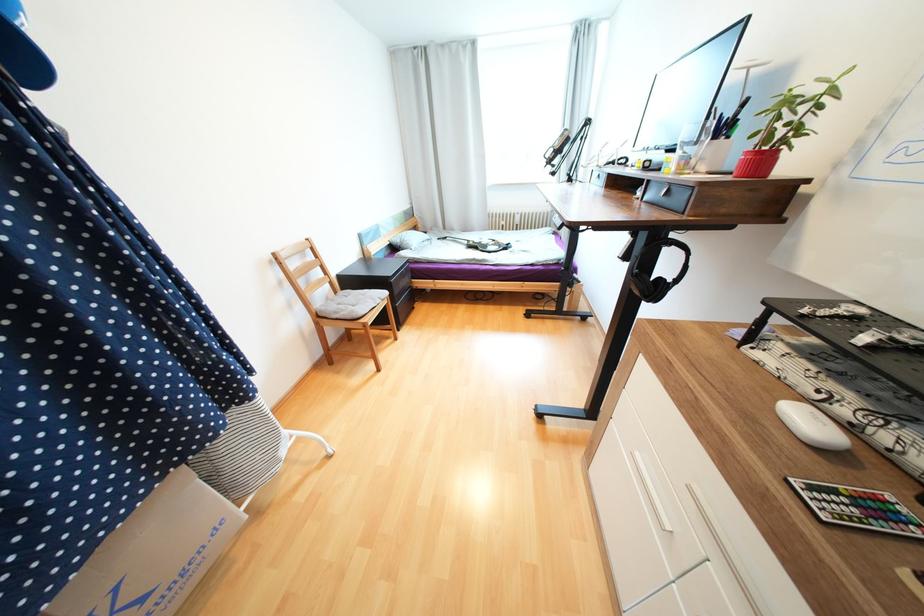
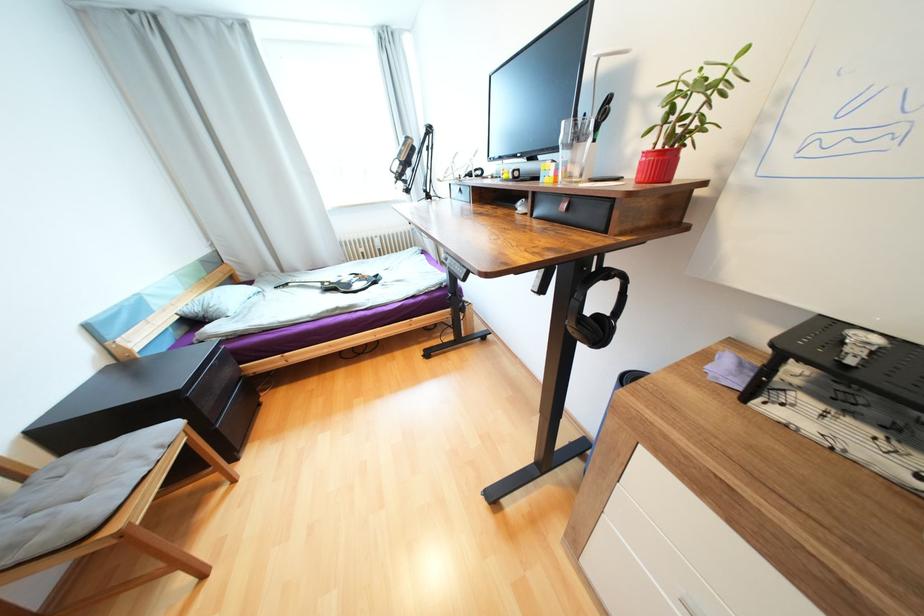
Question: The camera is either moving clockwise (left) or counter-clockwise (right) around the object. The first image is from the beginning of the video and the second image is from the end. Is the camera moving left or right when shooting the video?

Choices:
 (A) Left
 (B) Right

Answer: (A)